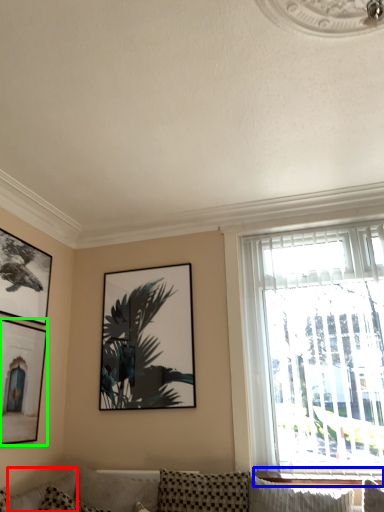
Question: Which object is positioned farthest from pillow (highlighted by a red box)? Select from window sill (highlighted by a blue box) and picture frame (highlighted by a green box).

Choices:
 (A) window sill
 (B) picture frame

Answer: (A)